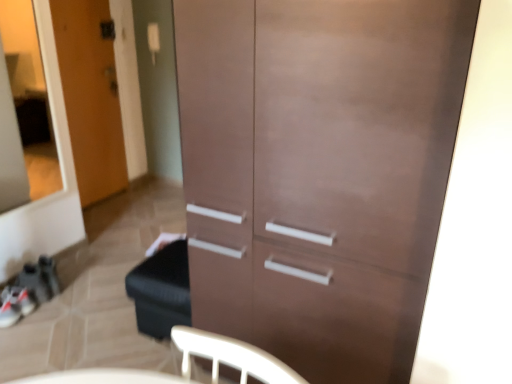
Where is `transparent glass door at upper left`? This screenshot has height=384, width=512. transparent glass door at upper left is located at coordinates (10, 143).

Where is `wooden door at left`? Image resolution: width=512 pixels, height=384 pixels. wooden door at left is located at coordinates (90, 97).

Is point (327, 96) farther from camera compared to point (3, 59)?

That is False.

Considering the sizes of objects matte brown cabinet at center and transparent glass door at upper left in the image provided, who is shorter, matte brown cabinet at center or transparent glass door at upper left?

transparent glass door at upper left is shorter.

Is matte brown cabinet at center beside transparent glass door at upper left?

No, matte brown cabinet at center is not beside transparent glass door at upper left.

Is matte brown cabinet at center closer to camera compared to transparent glass door at upper left?

Yes, matte brown cabinet at center is in front of transparent glass door at upper left.

From a real-world perspective, is wooden door at left beneath transparent glass door at upper left?

Correct, in the physical world, wooden door at left is lower than transparent glass door at upper left.

Does wooden door at left lie in front of transparent glass door at upper left?

No, it is not.

Looking at the image, does wooden door at left seem bigger or smaller compared to transparent glass door at upper left?

wooden door at left is bigger than transparent glass door at upper left.

Is wooden door at left next to transparent glass door at upper left?

No, wooden door at left is not touching transparent glass door at upper left.

Identify the location of glass door located above the matte brown cabinet at center (from a real-world perspective). (10, 143).

Considering the sizes of objects transparent glass door at upper left and matte brown cabinet at center in the image provided, who is shorter, transparent glass door at upper left or matte brown cabinet at center?

Standing shorter between the two is transparent glass door at upper left.

Is transparent glass door at upper left looking in the opposite direction of matte brown cabinet at center?

No, matte brown cabinet at center is not at the back of transparent glass door at upper left.

Locate an element on the screen. cupboard on the right of the wooden door at left is located at coordinates (340, 185).

How distant is matte brown cabinet at center from wooden door at left?

matte brown cabinet at center and wooden door at left are 8.12 feet apart.

Could wooden door at left be considered to be inside matte brown cabinet at center?

No.

Who is smaller, matte brown cabinet at center or wooden door at left?

Smaller between the two is wooden door at left.

Are transparent glass door at upper left and wooden door at left located far from each other?

That's not correct — transparent glass door at upper left is a little close to wooden door at left.

Considering the positions of objects transparent glass door at upper left and wooden door at left in the image provided, who is more to the left, transparent glass door at upper left or wooden door at left?

wooden door at left.

Looking at this image, from the image's perspective, is transparent glass door at upper left beneath wooden door at left?

Yes.

Is transparent glass door at upper left taller or shorter than wooden door at left?

In the image, transparent glass door at upper left appears to be shorter than wooden door at left.

From a real-world perspective, between wooden door at left and matte brown cabinet at center, who is vertically higher?

wooden door at left, from a real-world perspective.

How distant is wooden door at left from matte brown cabinet at center?

They are 8.12 feet apart.

Could you tell me if wooden door at left is facing matte brown cabinet at center?

No, wooden door at left is not oriented towards matte brown cabinet at center.

Does point (116, 186) lie in front of point (374, 107)?

No.

Where is `glass door above the matte brown cabinet at center (from a real-world perspective)`? This screenshot has width=512, height=384. glass door above the matte brown cabinet at center (from a real-world perspective) is located at coordinates (10, 143).

In the image, there is a wooden door at left. Where is `glass door below it (from the image's perspective)`? This screenshot has width=512, height=384. glass door below it (from the image's perspective) is located at coordinates (10, 143).

Estimate the real-world distances between objects in this image. Which object is closer to matte brown cabinet at center, wooden door at left or transparent glass door at upper left?

The object closer to matte brown cabinet at center is wooden door at left.

Estimate the real-world distances between objects in this image. Which object is closer to matte brown cabinet at center, transparent glass door at upper left or wooden door at left?

wooden door at left is closer to matte brown cabinet at center.

Estimate the real-world distances between objects in this image. Which object is further from wooden door at left, matte brown cabinet at center or transparent glass door at upper left?

The object further to wooden door at left is matte brown cabinet at center.

When comparing their distances from transparent glass door at upper left, does wooden door at left or matte brown cabinet at center seem closer?

Based on the image, wooden door at left appears to be nearer to transparent glass door at upper left.

From the image, which object appears to be nearer to transparent glass door at upper left, matte brown cabinet at center or wooden door at left?

The object closer to transparent glass door at upper left is wooden door at left.

Consider the image. Looking at the image, which one is located further to wooden door at left, transparent glass door at upper left or matte brown cabinet at center?

matte brown cabinet at center is positioned further to the anchor wooden door at left.

Identify the location of glass door between matte brown cabinet at center and wooden door at left from front to back. Image resolution: width=512 pixels, height=384 pixels. (10, 143).